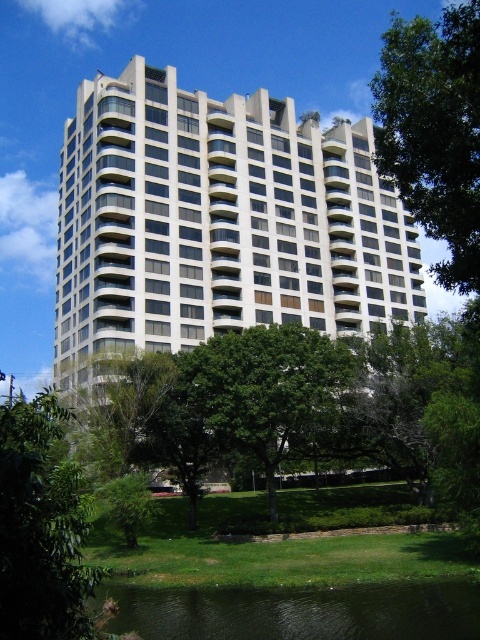
Which is below, green leafy tree at upper right or green leafy tree at center?

green leafy tree at center

Between point (451, 77) and point (228, 422), which one is positioned in front?

Point (451, 77) is in front.

You are a GUI agent. You are given a task and a screenshot of the screen. Output one action in this format:
    pyautogui.click(x=<x>, y=<y>)
    Task: Click on the green leafy tree at upper right
    The height and width of the screenshot is (640, 480).
    Given the screenshot: What is the action you would take?
    pyautogui.click(x=434, y=131)

Who is shorter, green liquid water at lower center or green leafy tree at center?

Standing shorter between the two is green liquid water at lower center.

At what (x,y) coordinates should I click in order to perform the action: click on green liquid water at lower center. Please return your answer as a coordinate pair (x, y). Looking at the image, I should click on (300, 611).

Looking at this image, is white glass building at center bigger than green leafy tree at upper right?

No, white glass building at center is not bigger than green leafy tree at upper right.

Measure the distance from white glass building at center to green leafy tree at upper right.

white glass building at center is 102.53 feet away from green leafy tree at upper right.

Does point (340, 282) come farther from viewer compared to point (450, 26)?

Yes, point (340, 282) is farther from viewer.

Locate an element on the screen. white glass building at center is located at coordinates (218, 221).